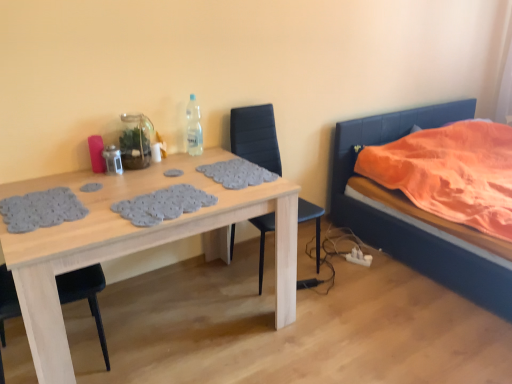
Where is `vacant space underneath black leather chair at center (from a real-world perspective)`? The height and width of the screenshot is (384, 512). vacant space underneath black leather chair at center (from a real-world perspective) is located at coordinates (259, 265).